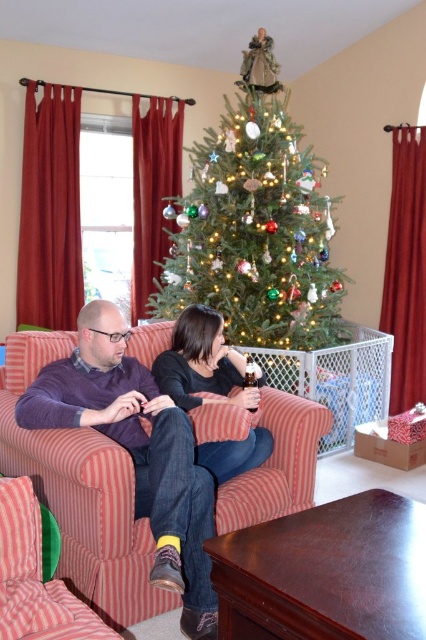
Is black matte shirt at center taller than pink striped couch at lower left?

Correct, black matte shirt at center is much taller as pink striped couch at lower left.

Is point (221, 337) behind point (94, 628)?

Yes, it is behind point (94, 628).

Which is in front, point (221, 394) or point (58, 618)?

Point (58, 618) is in front.

Identify the location of black matte shirt at center. (204, 364).

Which is more to the left, striped fabric couch at center or pink striped couch at lower left?

Positioned to the left is striped fabric couch at center.

Is the position of striped fabric couch at center less distant than that of pink striped couch at lower left?

That is False.

The width and height of the screenshot is (426, 640). In order to click on striped fabric couch at center in this screenshot , I will do `click(80, 493)`.

At what (x,y) coordinates should I click in order to perform the action: click on striped fabric couch at center. Please return your answer as a coordinate pair (x, y). Looking at the image, I should click on (80, 493).

Describe the element at coordinates (255, 224) in the screenshot. I see `green matte christmas tree at center` at that location.

Is green matte christmas tree at center smaller than black matte shirt at center?

Actually, green matte christmas tree at center might be larger than black matte shirt at center.

Describe the element at coordinates (255, 224) in the screenshot. I see `green matte christmas tree at center` at that location.

Where is `green matte christmas tree at center`? The width and height of the screenshot is (426, 640). green matte christmas tree at center is located at coordinates (255, 224).